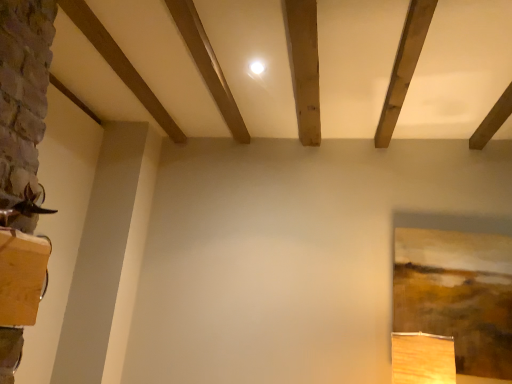
Question: From the image's perspective, is wooden beam at upper left, which appears as the second plank when viewed from the right, on smooth wooden plank at upper left, marked as the 2th plank in a left-to-right arrangement?

Choices:
 (A) no
 (B) yes

Answer: (B)

Question: Considering the relative sizes of wooden beam at upper left, which appears as the first plank when viewed from the left, and smooth wooden plank at upper left, marked as the 2th plank in a left-to-right arrangement, in the image provided, is wooden beam at upper left, which appears as the first plank when viewed from the left, bigger than smooth wooden plank at upper left, marked as the 2th plank in a left-to-right arrangement,?

Choices:
 (A) yes
 (B) no

Answer: (A)

Question: Does wooden beam at upper left, which appears as the second plank when viewed from the right, contain smooth wooden plank at upper left, the first plank in the right-to-left sequence?

Choices:
 (A) yes
 (B) no

Answer: (B)

Question: Would you say wooden beam at upper left, which appears as the second plank when viewed from the right, is a long distance from smooth wooden plank at upper left, the first plank in the right-to-left sequence?

Choices:
 (A) yes
 (B) no

Answer: (B)

Question: From a real-world perspective, is wooden beam at upper left, which appears as the second plank when viewed from the right, beneath smooth wooden plank at upper left, the first plank in the right-to-left sequence?

Choices:
 (A) no
 (B) yes

Answer: (B)

Question: Would you say wooden beam at upper left, which appears as the first plank when viewed from the left, is outside smooth wooden plank at upper left, marked as the 2th plank in a left-to-right arrangement?

Choices:
 (A) no
 (B) yes

Answer: (B)

Question: Does smooth wooden plank at upper left, the first plank in the right-to-left sequence, have a lesser width compared to wooden beam at upper left, which appears as the first plank when viewed from the left?

Choices:
 (A) yes
 (B) no

Answer: (A)

Question: Is smooth wooden plank at upper left, the first plank in the right-to-left sequence, positioned with its back to wooden beam at upper left, which appears as the second plank when viewed from the right?

Choices:
 (A) yes
 (B) no

Answer: (A)

Question: Would you consider smooth wooden plank at upper left, marked as the 2th plank in a left-to-right arrangement, to be distant from wooden beam at upper left, which appears as the first plank when viewed from the left?

Choices:
 (A) yes
 (B) no

Answer: (B)

Question: From the image's perspective, does smooth wooden plank at upper left, marked as the 2th plank in a left-to-right arrangement, appear lower than wooden beam at upper left, which appears as the first plank when viewed from the left?

Choices:
 (A) no
 (B) yes

Answer: (B)

Question: From a real-world perspective, is smooth wooden plank at upper left, marked as the 2th plank in a left-to-right arrangement, under wooden beam at upper left, which appears as the first plank when viewed from the left?

Choices:
 (A) yes
 (B) no

Answer: (B)

Question: Can you confirm if smooth wooden plank at upper left, the first plank in the right-to-left sequence, is smaller than wooden beam at upper left, which appears as the second plank when viewed from the right?

Choices:
 (A) yes
 (B) no

Answer: (A)

Question: Would you say smooth wooden plank at upper left, marked as the 2th plank in a left-to-right arrangement, is to the left or to the right of wooden beam at upper left, which appears as the first plank when viewed from the left, in the picture?

Choices:
 (A) right
 (B) left

Answer: (A)